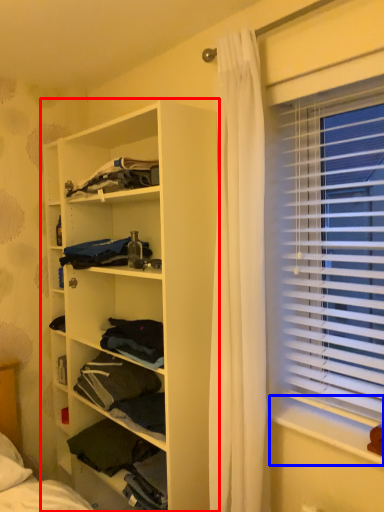
Question: Which object is further to the camera taking this photo, shelf (highlighted by a red box) or window sill (highlighted by a blue box)?

Choices:
 (A) shelf
 (B) window sill

Answer: (A)